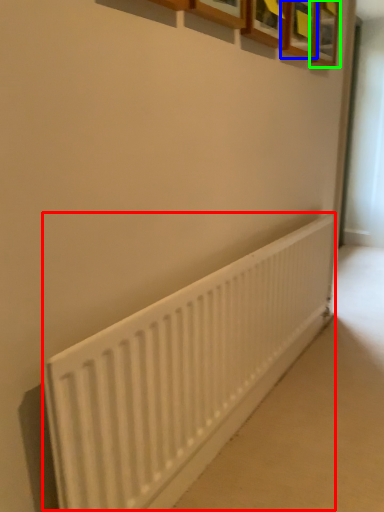
Question: Considering the real-world distances, which object is farthest from radiator (highlighted by a red box)? picture frame (highlighted by a blue box) or picture frame (highlighted by a green box)?

Choices:
 (A) picture frame
 (B) picture frame

Answer: (B)